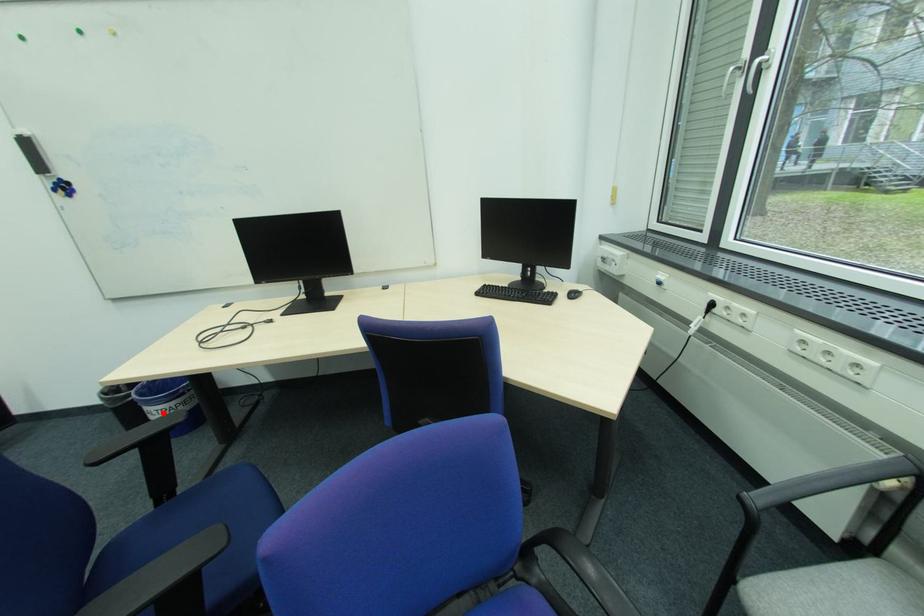
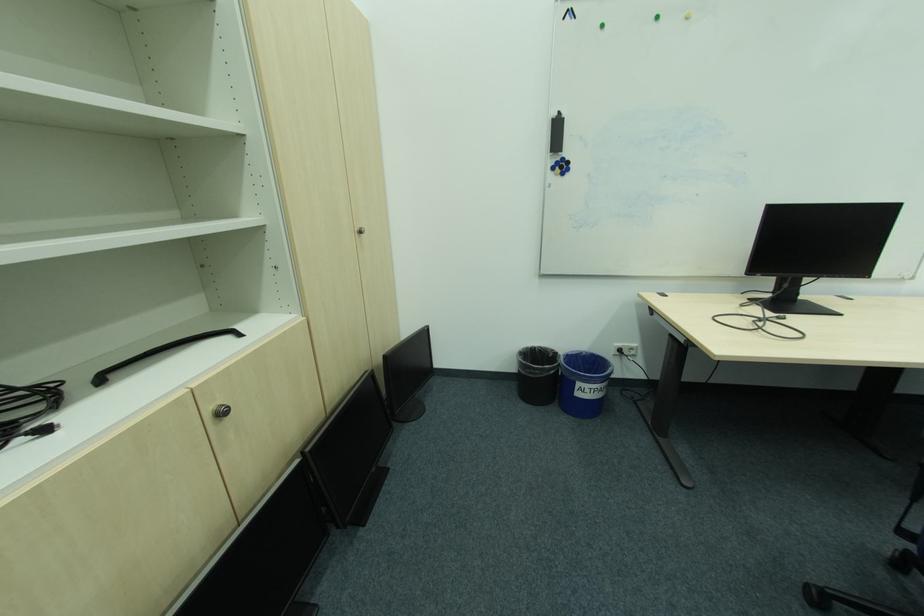
The point at the highlighted location is marked in the first image. Where is the corresponding point in the second image?

(593, 391)